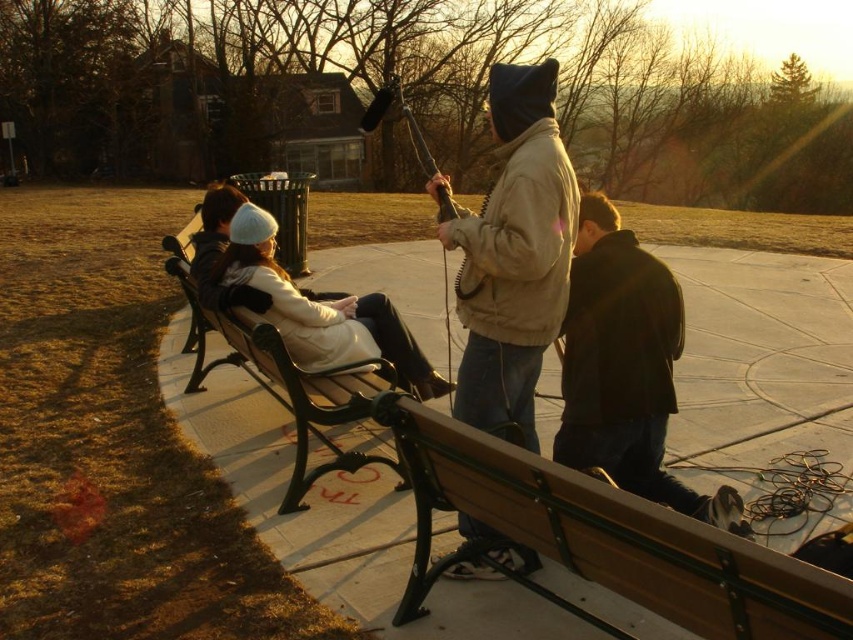
Question: Which of these objects is positioned closest to the white woolen hat at center?

Choices:
 (A) wooden park bench at lower right
 (B) wooden bench at center
 (C) beige cotton jacket at center
 (D) dark brown leather jacket at lower right

Answer: (B)

Question: Does wooden bench at center appear on the right side of white woolen hat at center?

Choices:
 (A) no
 (B) yes

Answer: (A)

Question: Estimate the real-world distances between objects in this image. Which object is farther from the wooden bench at center?

Choices:
 (A) beige cotton jacket at center
 (B) white woolen hat at center
 (C) wooden park bench at lower right
 (D) dark brown leather jacket at lower right

Answer: (C)

Question: Which point is farther to the camera?

Choices:
 (A) beige cotton jacket at center
 (B) dark brown leather jacket at lower right

Answer: (B)

Question: Is the position of wooden park bench at lower right more distant than that of wooden bench at center?

Choices:
 (A) yes
 (B) no

Answer: (B)

Question: Can you confirm if beige cotton jacket at center is positioned to the right of dark brown leather jacket at lower right?

Choices:
 (A) yes
 (B) no

Answer: (B)